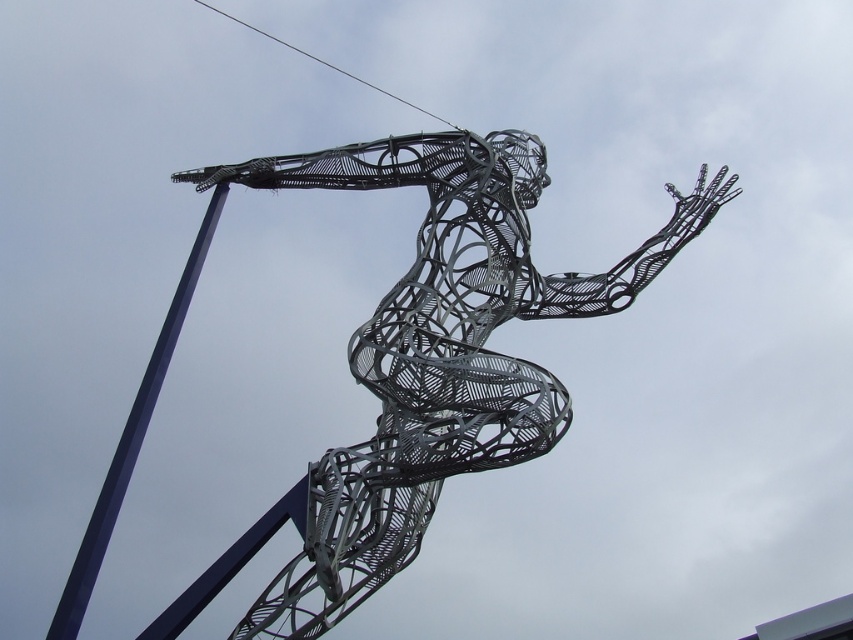
You are an art installer checking the sculpture. You notice the blue metallic pole at left and the metallic wire at upper center. Which object is located below the other?

The blue metallic pole at left is positioned under metallic wire at upper center, so the pole is below the wire.

In the scene shown: You are standing in front of the metal sculpture and notice two points marked on it. The first point is at coordinates point (398, 138) and the second is at point (305, 51). Which of these points is nearer to you?

Point (398, 138) is closer to the viewer than point (305, 51).